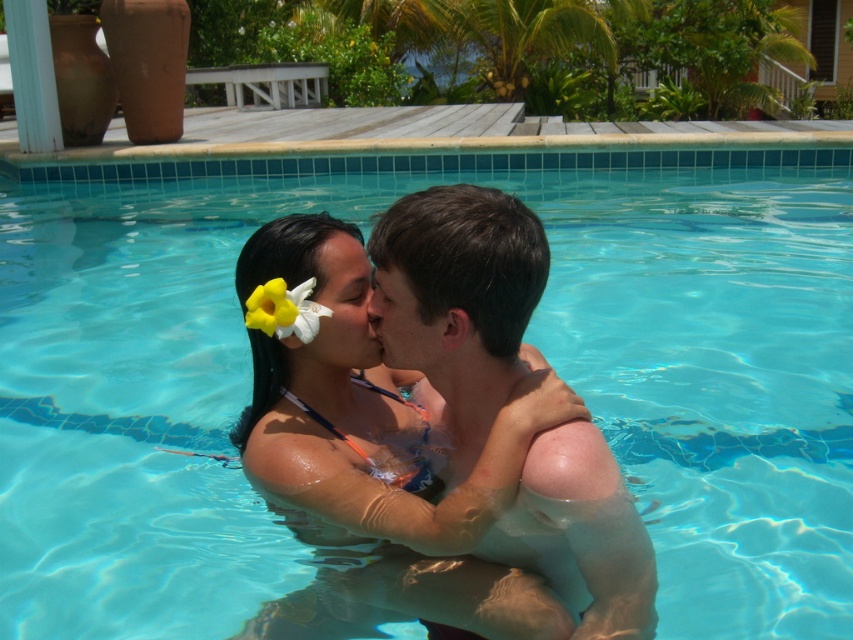
You are a photographer trying to capture a closeup of the couple in the swimming pool. You notice two points marked in the scene. Which point is closer to your camera lens? Please choose between point (x=276, y=332) and point (x=383, y=314).

Point (x=276, y=332) is further to the camera than point (x=383, y=314), so the closer point to the camera lens is point (x=383, y=314).